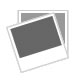
What are the coordinates of `white borders` in the screenshot? It's located at (34, 60), (66, 26), (58, 30), (13, 45), (31, 21), (20, 20), (43, 12).